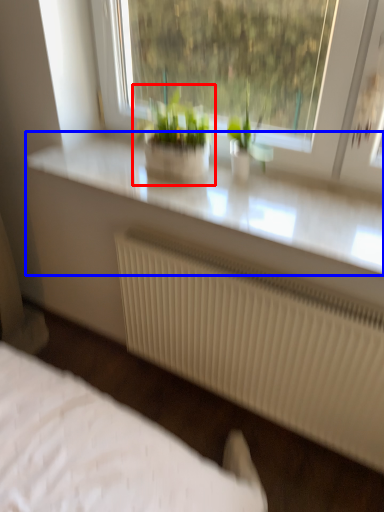
Question: Among these objects, which one is farthest to the camera, houseplant (highlighted by a red box) or counter top (highlighted by a blue box)?

Choices:
 (A) houseplant
 (B) counter top

Answer: (A)